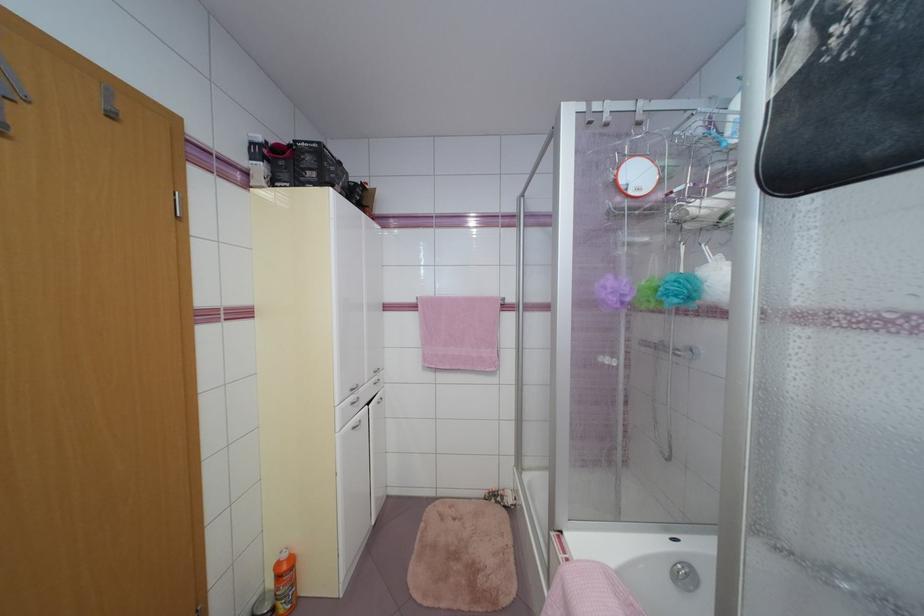
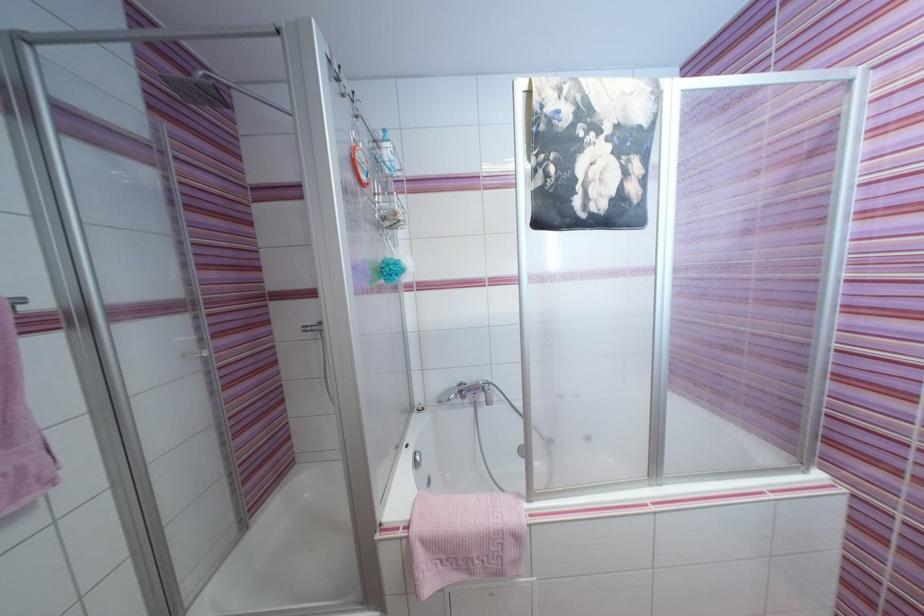
Locate, in the second image, the point that corresponds to point (674, 298) in the first image.

(395, 277)